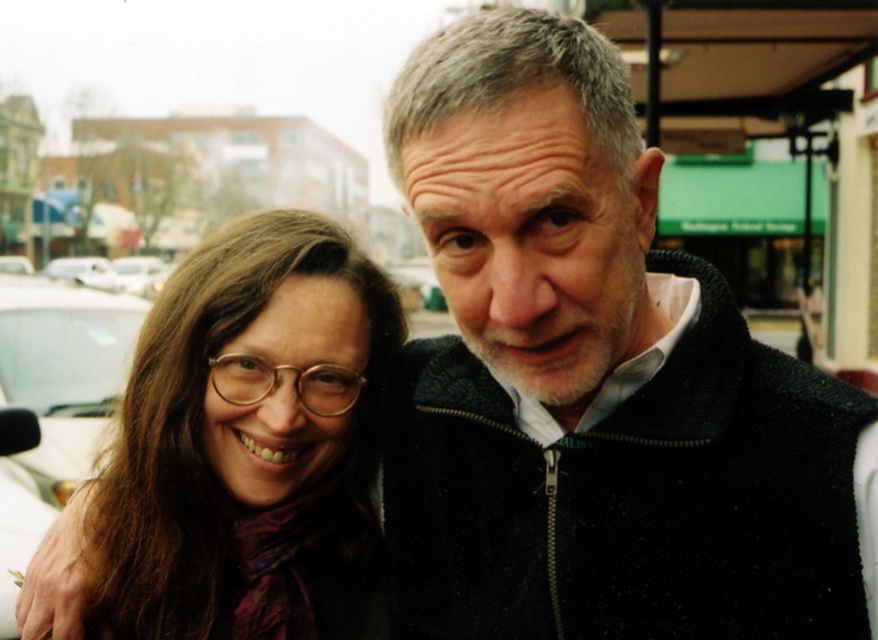
Question: Can you confirm if matte brown hair at center is positioned below white matte car at left?

Choices:
 (A) yes
 (B) no

Answer: (B)

Question: Can you confirm if matte brown hair at center is thinner than white matte car at left?

Choices:
 (A) no
 (B) yes

Answer: (A)

Question: Is matte brown hair at center above white matte car at left?

Choices:
 (A) no
 (B) yes

Answer: (B)